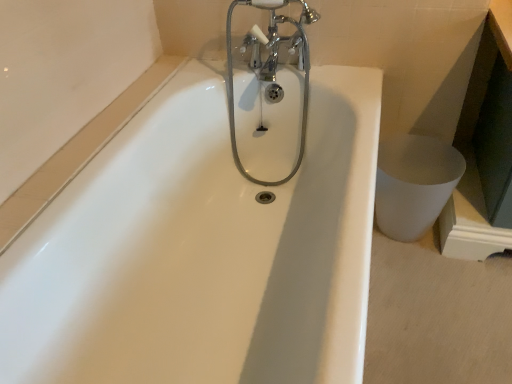
You are a GUI agent. You are given a task and a screenshot of the screen. Output one action in this format:
    pyautogui.click(x=<x>, y=<y>)
    Task: Click on the white glossy toilet bowl at lower right
    This screenshot has height=384, width=512.
    Given the screenshot: What is the action you would take?
    pyautogui.click(x=414, y=184)

Measure the distance between point (442, 161) and camera.

The distance of point (442, 161) from camera is 1.56 meters.

What do you see at coordinates (414, 184) in the screenshot? Image resolution: width=512 pixels, height=384 pixels. I see `white glossy toilet bowl at lower right` at bounding box center [414, 184].

What is the approximate width of chrome metallic faucet at upper center?

7.65 inches.

What do you see at coordinates (270, 68) in the screenshot? The width and height of the screenshot is (512, 384). I see `chrome metallic faucet at upper center` at bounding box center [270, 68].

This screenshot has width=512, height=384. I want to click on chrome metallic faucet at upper center, so click(x=270, y=68).

What are the coordinates of `white glossy toilet bowl at lower right` in the screenshot? It's located at (414, 184).

Which is more to the left, white glossy toilet bowl at lower right or chrome metallic faucet at upper center?

chrome metallic faucet at upper center is more to the left.

Which is behind, white glossy toilet bowl at lower right or chrome metallic faucet at upper center?

white glossy toilet bowl at lower right is further from the camera.

Between point (397, 227) and point (278, 37), which one is positioned in front?

The point (278, 37) is in front.

From the image's perspective, which one is positioned higher, white glossy toilet bowl at lower right or chrome metallic faucet at upper center?

chrome metallic faucet at upper center, from the image's perspective.

From a real-world perspective, is white glossy toilet bowl at lower right located beneath chrome metallic faucet at upper center?

Yes, from a real-world perspective, white glossy toilet bowl at lower right is under chrome metallic faucet at upper center.

Considering the sizes of objects white glossy toilet bowl at lower right and chrome metallic faucet at upper center in the image provided, who is thinner, white glossy toilet bowl at lower right or chrome metallic faucet at upper center?

white glossy toilet bowl at lower right is thinner.

Considering the sizes of objects white glossy toilet bowl at lower right and chrome metallic faucet at upper center in the image provided, who is taller, white glossy toilet bowl at lower right or chrome metallic faucet at upper center?

Standing taller between the two is chrome metallic faucet at upper center.

In terms of size, does white glossy toilet bowl at lower right appear bigger or smaller than chrome metallic faucet at upper center?

Clearly, white glossy toilet bowl at lower right is smaller in size than chrome metallic faucet at upper center.

Would you say chrome metallic faucet at upper center is part of white glossy toilet bowl at lower right's contents?

No, white glossy toilet bowl at lower right does not contain chrome metallic faucet at upper center.

Are white glossy toilet bowl at lower right and chrome metallic faucet at upper center far apart?

That's not correct — white glossy toilet bowl at lower right is a little close to chrome metallic faucet at upper center.

Is white glossy toilet bowl at lower right facing towards chrome metallic faucet at upper center?

No, white glossy toilet bowl at lower right is not oriented towards chrome metallic faucet at upper center.

How many degrees apart are the facing directions of white glossy toilet bowl at lower right and chrome metallic faucet at upper center?

1.29 degrees.

You are a GUI agent. You are given a task and a screenshot of the screen. Output one action in this format:
    pyautogui.click(x=<x>, y=<y>)
    Task: Click on the toilet bowl that appears on the right of chrome metallic faucet at upper center
    The width and height of the screenshot is (512, 384).
    Given the screenshot: What is the action you would take?
    pyautogui.click(x=414, y=184)

Based on the photo, is chrome metallic faucet at upper center to the left of white glossy toilet bowl at lower right from the viewer's perspective?

Yes, chrome metallic faucet at upper center is to the left of white glossy toilet bowl at lower right.

Does chrome metallic faucet at upper center lie in front of white glossy toilet bowl at lower right?

Yes, it is.

Considering the positions of point (232, 87) and point (436, 192), is point (232, 87) closer or farther from the camera than point (436, 192)?

Point (232, 87) appears to be farther away from the viewer than point (436, 192).

From the image's perspective, which is above, chrome metallic faucet at upper center or white glossy toilet bowl at lower right?

chrome metallic faucet at upper center is shown above in the image.

In the scene shown: From a real-world perspective, which is physically below, chrome metallic faucet at upper center or white glossy toilet bowl at lower right?

From a 3D spatial view, white glossy toilet bowl at lower right is below.

Is chrome metallic faucet at upper center wider or thinner than white glossy toilet bowl at lower right?

Clearly, chrome metallic faucet at upper center has more width compared to white glossy toilet bowl at lower right.

Considering the sizes of chrome metallic faucet at upper center and white glossy toilet bowl at lower right in the image, is chrome metallic faucet at upper center taller or shorter than white glossy toilet bowl at lower right?

In the image, chrome metallic faucet at upper center appears to be taller than white glossy toilet bowl at lower right.

Is chrome metallic faucet at upper center bigger than white glossy toilet bowl at lower right?

Yes.

Choose the correct answer: Is chrome metallic faucet at upper center inside white glossy toilet bowl at lower right or outside it?

chrome metallic faucet at upper center lies outside white glossy toilet bowl at lower right.

Are chrome metallic faucet at upper center and white glossy toilet bowl at lower right making contact?

There is a gap between chrome metallic faucet at upper center and white glossy toilet bowl at lower right.

Is white glossy toilet bowl at lower right at the back of chrome metallic faucet at upper center?

No, chrome metallic faucet at upper center is not facing away from white glossy toilet bowl at lower right.

How many degrees apart are the facing directions of chrome metallic faucet at upper center and white glossy toilet bowl at lower right?

The angular difference between chrome metallic faucet at upper center and white glossy toilet bowl at lower right is 1.29 degrees.

Image resolution: width=512 pixels, height=384 pixels. Identify the location of toilet bowl below the chrome metallic faucet at upper center (from the image's perspective). (414, 184).

In the image, there is a white glossy toilet bowl at lower right. Where is `tap above it (from the image's perspective)`? tap above it (from the image's perspective) is located at coordinates (270, 68).

This screenshot has width=512, height=384. Find the location of `tap above the white glossy toilet bowl at lower right (from a real-world perspective)`. tap above the white glossy toilet bowl at lower right (from a real-world perspective) is located at coordinates (270, 68).